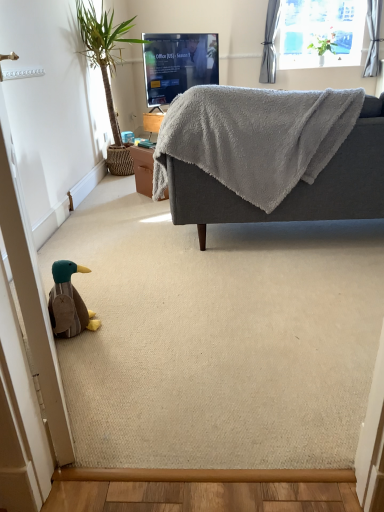
This screenshot has height=512, width=384. Identify the location of free space to the back side of brown plush duck at lower left. (107, 301).